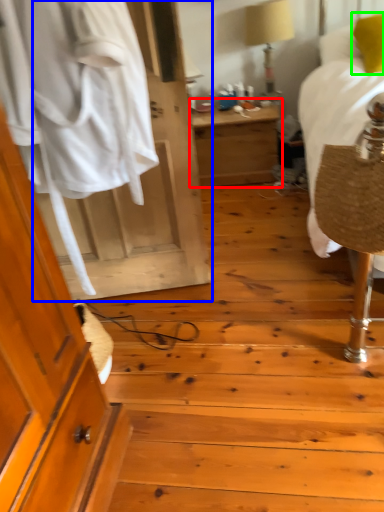
Question: Which object is positioned farthest from nightstand (highlighted by a red box)? Select from door (highlighted by a blue box) and pillow (highlighted by a green box).

Choices:
 (A) door
 (B) pillow

Answer: (A)